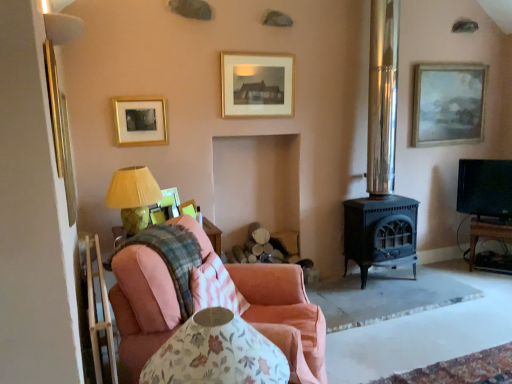
Find the location of a particular element. The width and height of the screenshot is (512, 384). free spot to the left of wooden tv stand at right is located at coordinates (452, 266).